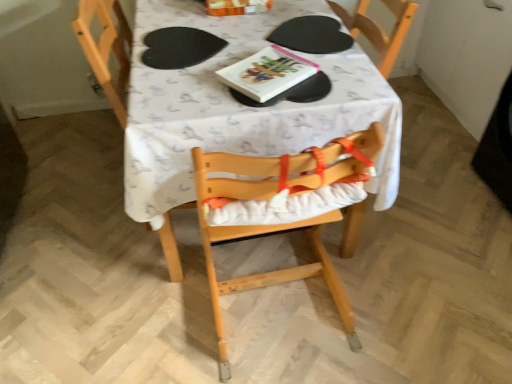
The image size is (512, 384). Find the location of `empty space that is ontop of black matte paper plate at center (from a real-world perspective)`. empty space that is ontop of black matte paper plate at center (from a real-world perspective) is located at coordinates (308, 18).